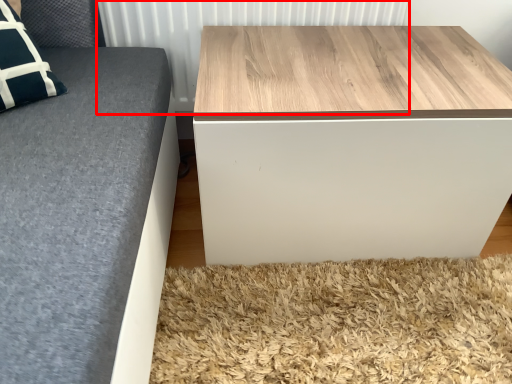
Question: From the image's perspective, considering the relative positions of radiator (annotated by the red box) and table in the image provided, where is radiator (annotated by the red box) located with respect to the staircase?

Choices:
 (A) below
 (B) above

Answer: (B)